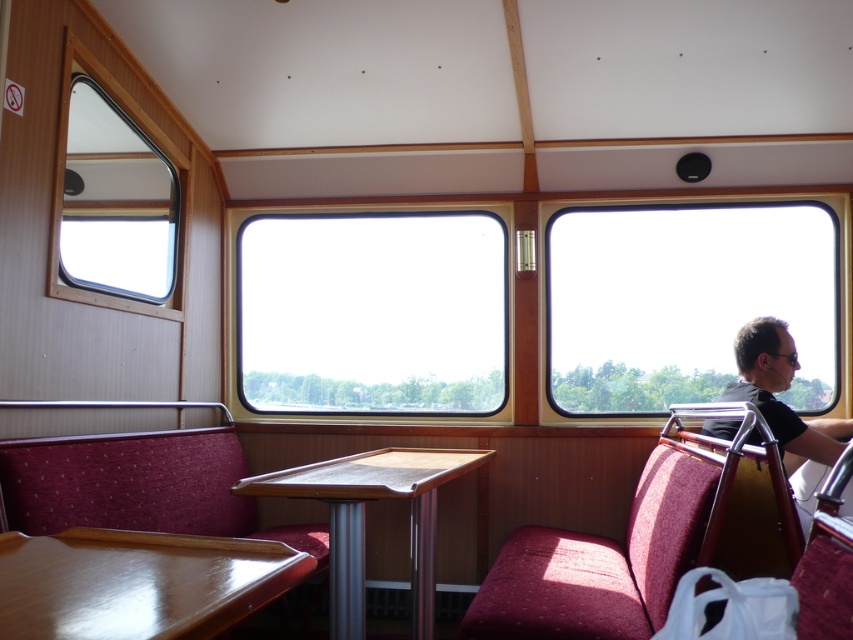
What do you see at coordinates (685, 300) in the screenshot? The image size is (853, 640). I see `transparent glass window at right` at bounding box center [685, 300].

Does transparent glass window at right have a lesser width compared to wooden/metallic table at center?

No, transparent glass window at right is not thinner than wooden/metallic table at center.

Who is more forward, (659, 266) or (354, 604)?

Positioned in front is point (354, 604).

Where is `transparent glass window at right`? The height and width of the screenshot is (640, 853). transparent glass window at right is located at coordinates (685, 300).

Does transparent glass window at right have a greater height compared to velvet maroon chair at lower left?

Indeed, transparent glass window at right has a greater height compared to velvet maroon chair at lower left.

Who is more forward, (648, 332) or (103, 445)?

Point (103, 445) is in front.

Which is behind, point (793, 305) or point (190, 497)?

The point (793, 305) is behind.

This screenshot has height=640, width=853. What are the coordinates of `transparent glass window at right` in the screenshot? It's located at (685, 300).

Looking at this image, is transparent glass window at right further to camera compared to matte black shirt at right?

Yes, transparent glass window at right is behind matte black shirt at right.

Can you confirm if transparent glass window at right is positioned to the left of matte black shirt at right?

Incorrect, transparent glass window at right is not on the left side of matte black shirt at right.

The height and width of the screenshot is (640, 853). Identify the location of transparent glass window at right. 685,300.